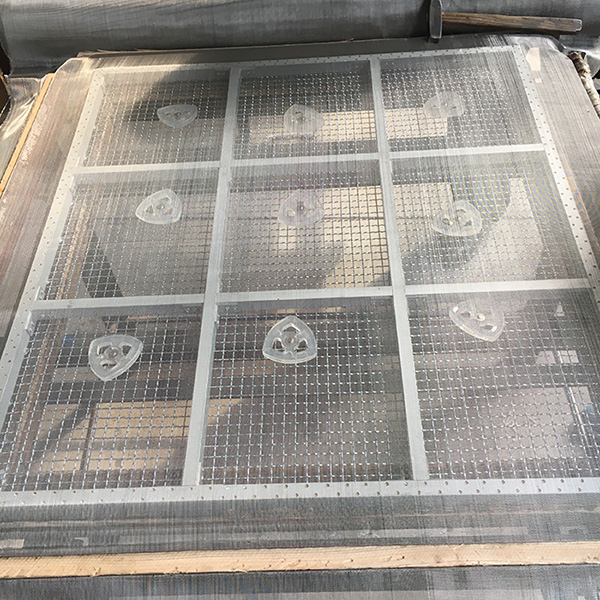
This screenshot has width=600, height=600. I want to click on wooden framed edge, so click(38, 570), click(254, 569), click(440, 556), click(560, 550), click(6, 178), click(42, 98).